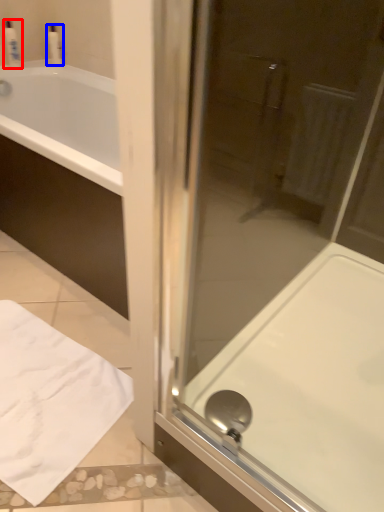
Question: Which point is further to the camera, toiletry (highlighted by a red box) or toiletry (highlighted by a blue box)?

Choices:
 (A) toiletry
 (B) toiletry

Answer: (B)